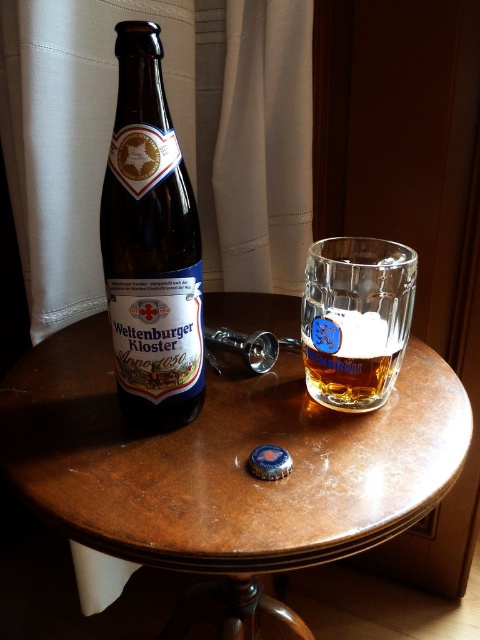
Please provide the coordinates of the brown wooden table at center in the image. The answer should be in the format of coordinates in parentheses and separated by a comma.

The coordinates of the brown wooden table at center are at point [228,465].

You are a photographer trying to capture the beer mug and the bottle in focus. You notice two points in the image at coordinates point (91,385) and point (134,234). Which point should you focus on to ensure both the mug and the bottle are sharp?

You should focus on point (91,385) because it is closer to the camera than point (134,234). By focusing on the closer point, the depth of field will extend to include the farther point, ensuring both the mug and the bottle are sharp.

You are hosting a dinner party and want to serve beer from the dark brown glass bottle at left into the clear glass mug at center. Will the mug hold all the beer from the bottle?

The dark brown glass bottle at left has a larger size compared to clear glass mug at center, so the mug may not hold all the beer from the bottle since the bottle holds more liquid than the mug can contain.